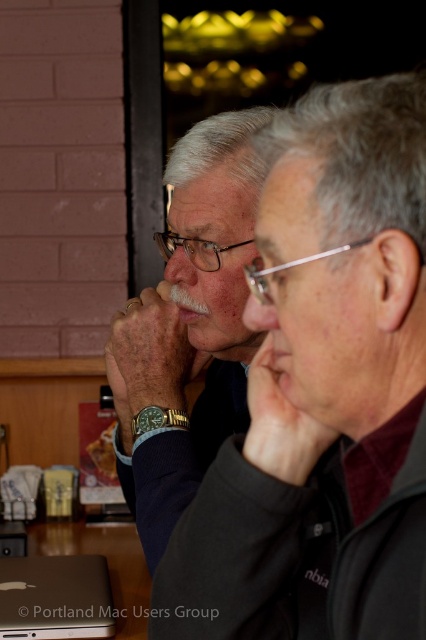
Question: Can you confirm if matte black jacket at center is positioned above matte black nose at center?

Choices:
 (A) yes
 (B) no

Answer: (B)

Question: Which point is farther to the camera?

Choices:
 (A) (20, 604)
 (B) (227, 401)
 (C) (250, 310)

Answer: (A)

Question: Among these objects, which one is nearest to the camera?

Choices:
 (A) matte black nose at center
 (B) matte black sweater at center
 (C) silver metallic laptop at lower left

Answer: (B)

Question: Considering the relative positions of matte black jacket at center and matte black nose at center in the image provided, where is matte black jacket at center located with respect to matte black nose at center?

Choices:
 (A) below
 (B) above

Answer: (A)

Question: Can you confirm if matte black sweater at center is thinner than matte skin nose at center?

Choices:
 (A) yes
 (B) no

Answer: (B)

Question: Which of the following is the farthest from the observer?

Choices:
 (A) matte black jacket at center
 (B) silver metallic laptop at lower left

Answer: (B)